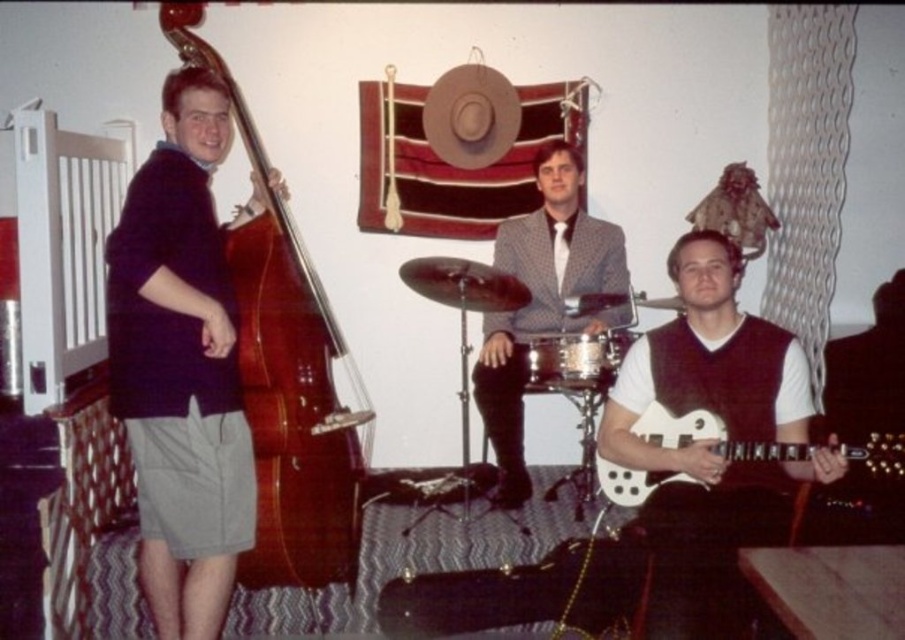
Is white glossy electric guitar at center to the left of shiny silver drum at center from the viewer's perspective?

In fact, white glossy electric guitar at center is to the right of shiny silver drum at center.

Can you confirm if white glossy electric guitar at center is positioned to the right of shiny silver drum at center?

Correct, you'll find white glossy electric guitar at center to the right of shiny silver drum at center.

Where is `white glossy electric guitar at center`? This screenshot has height=640, width=905. white glossy electric guitar at center is located at coordinates (717, 380).

Does matte black shirt at left appear on the left side of polka dot fabric suit at center?

Yes, matte black shirt at left is to the left of polka dot fabric suit at center.

Is matte black shirt at left wider than polka dot fabric suit at center?

Incorrect, matte black shirt at left's width does not surpass polka dot fabric suit at center's.

Is point (252, 541) behind point (496, 237)?

No.

At what (x,y) coordinates should I click in order to perform the action: click on matte black shirt at left. Please return your answer as a coordinate pair (x, y). Looking at the image, I should click on (181, 365).

Looking at this image, who is positioned more to the right, glossy wood cello at left or white glossy electric guitar at center?

white glossy electric guitar at center is more to the right.

Is glossy wood cello at left thinner than white glossy electric guitar at center?

Incorrect, glossy wood cello at left's width is not less than white glossy electric guitar at center's.

Between point (370, 413) and point (805, 436), which one is positioned behind?

Positioned behind is point (370, 413).

This screenshot has height=640, width=905. What are the coordinates of `glossy wood cello at left` in the screenshot? It's located at pos(286,376).